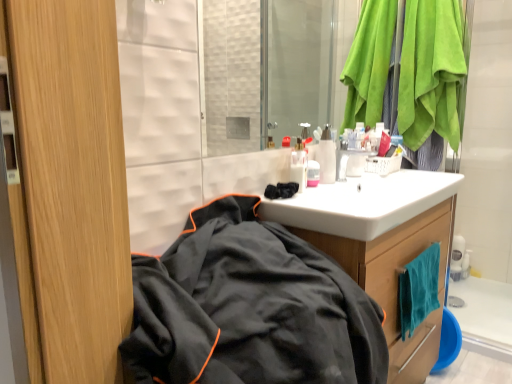
In order to face wooden cabinet at center, should I rotate leftwards or rightwards?

To face it directly, rotate right by 14.529 degrees.

Where is `green suede towel at upper right`? green suede towel at upper right is located at coordinates (x=431, y=71).

Locate an element on the screen. black fabric jacket at lower left is located at coordinates (249, 308).

The height and width of the screenshot is (384, 512). What do you see at coordinates (249, 308) in the screenshot?
I see `black fabric jacket at lower left` at bounding box center [249, 308].

Measure the distance between teal microfiber towel at lower right and camera.

teal microfiber towel at lower right and camera are 4.14 feet apart.

The height and width of the screenshot is (384, 512). What do you see at coordinates (418, 289) in the screenshot?
I see `teal microfiber towel at lower right` at bounding box center [418, 289].

What do you see at coordinates (362, 203) in the screenshot? I see `white glossy sink at center` at bounding box center [362, 203].

Locate an element on the screen. The image size is (512, 384). translucent plastic bottles at center, which is the second toiletry in right-to-left order is located at coordinates (298, 168).

The image size is (512, 384). There is a teal microfiber towel at lower right. Find the location of `jacket above it (from a real-world perspective)`. jacket above it (from a real-world perspective) is located at coordinates (249, 308).

Between point (432, 275) and point (292, 299), which one is positioned behind?

Positioned behind is point (432, 275).

Based on the photo, which object is closer to the camera, teal microfiber towel at lower right or black fabric jacket at lower left?

black fabric jacket at lower left is in front.

Based on the photo, does teal microfiber towel at lower right contain black fabric jacket at lower left?

No, black fabric jacket at lower left is located outside of teal microfiber towel at lower right.

Could translucent plastic bottles at center, which is the second toiletry in right-to-left order, be considered to be inside teal microfiber towel at lower right?

Definitely not — translucent plastic bottles at center, which is the second toiletry in right-to-left order, is not inside teal microfiber towel at lower right.

From the picture: From a real-world perspective, is teal microfiber towel at lower right physically above translucent plastic bottles at center, which ranks as the first toiletry in left-to-right order?

No, from a real-world perspective, teal microfiber towel at lower right is not over translucent plastic bottles at center, which ranks as the first toiletry in left-to-right order

Can you confirm if teal microfiber towel at lower right is bigger than translucent plastic bottles at center, which is the second toiletry in right-to-left order?

Yes.

Is pink glossy container at center, marked as the first toiletry in a right-to-left arrangement, beside green suede towel at upper right?

pink glossy container at center, marked as the first toiletry in a right-to-left arrangement, and green suede towel at upper right are not in contact.

Is green suede towel at upper right at the back of pink glossy container at center, marked as the first toiletry in a right-to-left arrangement?

No.

Is pink glossy container at center, marked as the first toiletry in a right-to-left arrangement, spatially inside green suede towel at upper right, or outside of it?

pink glossy container at center, marked as the first toiletry in a right-to-left arrangement, is spatially situated outside green suede towel at upper right.

Is the position of pink glossy container at center, marked as the first toiletry in a right-to-left arrangement, less distant than that of green suede towel at upper right?

Yes, the depth of pink glossy container at center, marked as the first toiletry in a right-to-left arrangement, is less than that of green suede towel at upper right.

Does point (412, 289) appear closer or farther from the camera than point (431, 43)?

Clearly, point (412, 289) is closer to the camera than point (431, 43).

Looking at this image, from a real-world perspective, is teal microfiber towel at lower right on green suede towel at upper right?

Incorrect, from a real-world perspective, teal microfiber towel at lower right is lower than green suede towel at upper right.

What's the angular difference between teal microfiber towel at lower right and green suede towel at upper right's facing directions?

1.84 degrees separate the facing orientations of teal microfiber towel at lower right and green suede towel at upper right.

Is translucent plastic bottles at center, which is the second toiletry in right-to-left order, beside black fabric jacket at lower left?

translucent plastic bottles at center, which is the second toiletry in right-to-left order, is not next to black fabric jacket at lower left, and they're not touching.

From a real-world perspective, is translucent plastic bottles at center, which is the second toiletry in right-to-left order, above or below black fabric jacket at lower left?

translucent plastic bottles at center, which is the second toiletry in right-to-left order, is situated higher than black fabric jacket at lower left in the real world.

Considering the sizes of objects translucent plastic bottles at center, which is the second toiletry in right-to-left order, and black fabric jacket at lower left in the image provided, who is bigger, translucent plastic bottles at center, which is the second toiletry in right-to-left order, or black fabric jacket at lower left?

With larger size is black fabric jacket at lower left.

Who is taller, white glossy sink at center or wooden cabinet at center?

wooden cabinet at center is taller.

In the scene shown: Who is smaller, white glossy sink at center or wooden cabinet at center?

With smaller size is white glossy sink at center.

Does white glossy sink at center turn towards wooden cabinet at center?

No, white glossy sink at center is not facing towards wooden cabinet at center.

Is point (422, 210) closer or farther from the camera than point (423, 80)?

Point (422, 210) appears to be closer to the viewer than point (423, 80).

Is white glossy sink at center oriented towards green suede towel at upper right?

No.

Which of these two, white glossy sink at center or green suede towel at upper right, is thinner?

green suede towel at upper right is thinner.

Can you confirm if white glossy sink at center is smaller than green suede towel at upper right?

Correct, white glossy sink at center occupies less space than green suede towel at upper right.

Find the location of `jacket that is above the teal microfiber towel at lower right (from a real-world perspective)`. jacket that is above the teal microfiber towel at lower right (from a real-world perspective) is located at coordinates (249, 308).

At what (x,y) coordinates should I click in order to perform the action: click on beach towel on the right of translucent plastic bottles at center, which ranks as the first toiletry in left-to-right order. Please return your answer as a coordinate pair (x, y). Looking at the image, I should click on 418,289.

When comparing their distances from translucent plastic bottles at center, which ranks as the first toiletry in left-to-right order, does teal microfiber towel at lower right or wooden cabinet at center seem further?

The object further to translucent plastic bottles at center, which ranks as the first toiletry in left-to-right order, is teal microfiber towel at lower right.

From the image, which object appears to be nearer to green suede towel at upper right, translucent plastic bottles at center, which is the second toiletry in right-to-left order, or black fabric jacket at lower left?

translucent plastic bottles at center, which is the second toiletry in right-to-left order, lies closer to green suede towel at upper right than the other object.

From the image, which object appears to be nearer to teal microfiber towel at lower right, pink glossy container at center, the second toiletry viewed from the left, or black fabric jacket at lower left?

Among the two, pink glossy container at center, the second toiletry viewed from the left, is located nearer to teal microfiber towel at lower right.

Looking at the image, which one is located further to pink glossy container at center, the second toiletry viewed from the left, teal microfiber towel at lower right or white glossy sink at center?

The object further to pink glossy container at center, the second toiletry viewed from the left, is teal microfiber towel at lower right.

Considering their positions, is white glossy sink at center positioned closer to pink glossy container at center, marked as the first toiletry in a right-to-left arrangement, than black fabric jacket at lower left?

Among the two, white glossy sink at center is located nearer to pink glossy container at center, marked as the first toiletry in a right-to-left arrangement.

Which object lies further to the anchor point teal microfiber towel at lower right, wooden cabinet at center or translucent plastic bottles at center, which ranks as the first toiletry in left-to-right order?

translucent plastic bottles at center, which ranks as the first toiletry in left-to-right order, lies further to teal microfiber towel at lower right than the other object.

Estimate the real-world distances between objects in this image. Which object is closer to white glossy sink at center, green suede towel at upper right or translucent plastic bottles at center, which ranks as the first toiletry in left-to-right order?

Based on the image, translucent plastic bottles at center, which ranks as the first toiletry in left-to-right order, appears to be nearer to white glossy sink at center.

Based on their spatial positions, is teal microfiber towel at lower right or wooden cabinet at center further from pink glossy container at center, marked as the first toiletry in a right-to-left arrangement?

The object further to pink glossy container at center, marked as the first toiletry in a right-to-left arrangement, is teal microfiber towel at lower right.

Find the location of `beach towel located between black fabric jacket at lower left and translucent plastic bottles at center, which is the second toiletry in right-to-left order, in the depth direction`. beach towel located between black fabric jacket at lower left and translucent plastic bottles at center, which is the second toiletry in right-to-left order, in the depth direction is located at coordinates (418, 289).

Where is `sink positioned between black fabric jacket at lower left and green suede towel at upper right from near to far`? sink positioned between black fabric jacket at lower left and green suede towel at upper right from near to far is located at coordinates (362, 203).

Where is `sink located between black fabric jacket at lower left and pink glossy container at center, the second toiletry viewed from the left, in the depth direction`? This screenshot has width=512, height=384. sink located between black fabric jacket at lower left and pink glossy container at center, the second toiletry viewed from the left, in the depth direction is located at coordinates (362, 203).

The image size is (512, 384). What are the coordinates of `toiletry between black fabric jacket at lower left and pink glossy container at center, marked as the first toiletry in a right-to-left arrangement, in the front-back direction` in the screenshot? It's located at (298, 168).